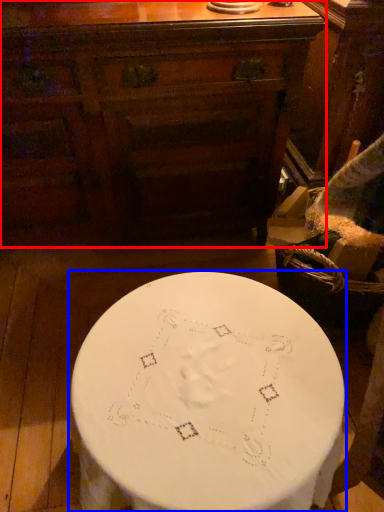
Question: Among these objects, which one is nearest to the camera, chest of drawers (highlighted by a red box) or table (highlighted by a blue box)?

Choices:
 (A) chest of drawers
 (B) table

Answer: (B)